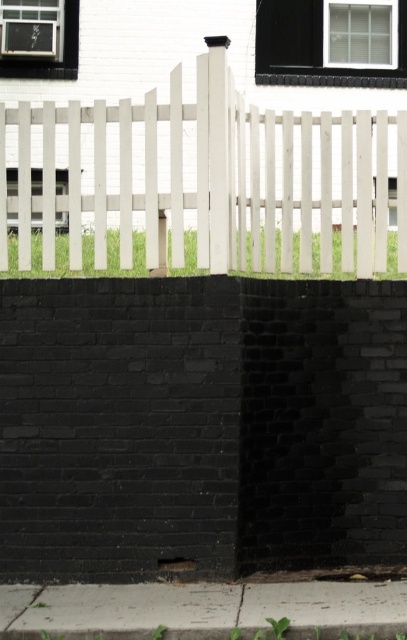
Where is `white wood fence at center`? The width and height of the screenshot is (407, 640). white wood fence at center is located at coordinates (210, 179).

Can you confirm if white wood fence at center is taller than gray concrete pavement at lower center?

Yes, white wood fence at center is taller than gray concrete pavement at lower center.

Is point (150, 164) positioned before point (291, 600)?

No, (150, 164) is behind (291, 600).

In order to click on white wood fence at center in this screenshot , I will do [210, 179].